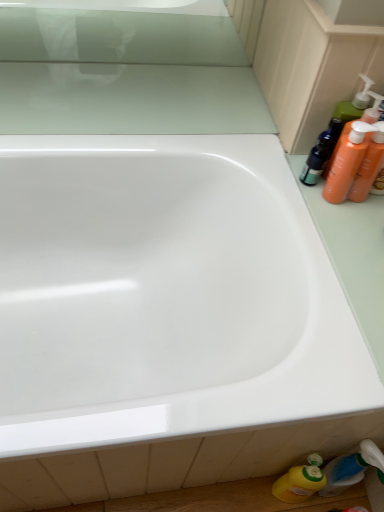
The image size is (384, 512). I want to click on free location in front of orange plastic bottles at right, positioned as the second toiletry in top-to-bottom order, so click(349, 232).